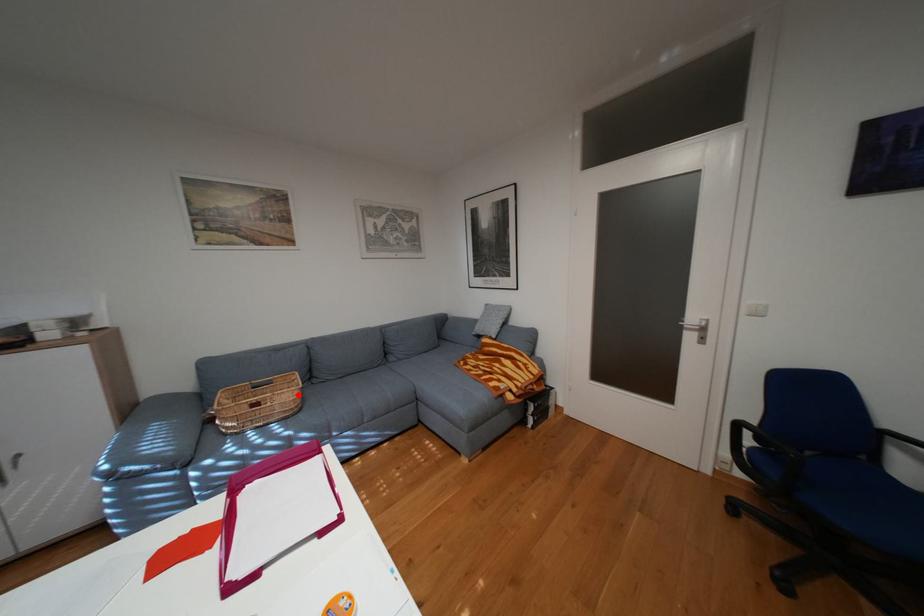
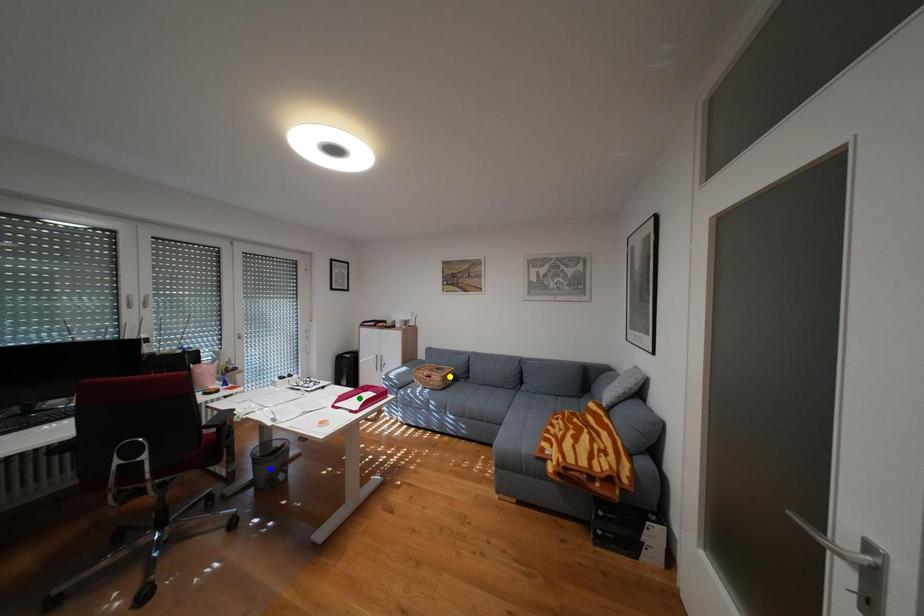
Question: I am providing you with two images of the same scene from different viewpoints. A red point is marked on the first image. You are given multiple points on the second image. In image 2, which mark is for the same physical point as the one in image 1?

Choices:
 (A) blue point
 (B) green point
 (C) yellow point

Answer: (C)